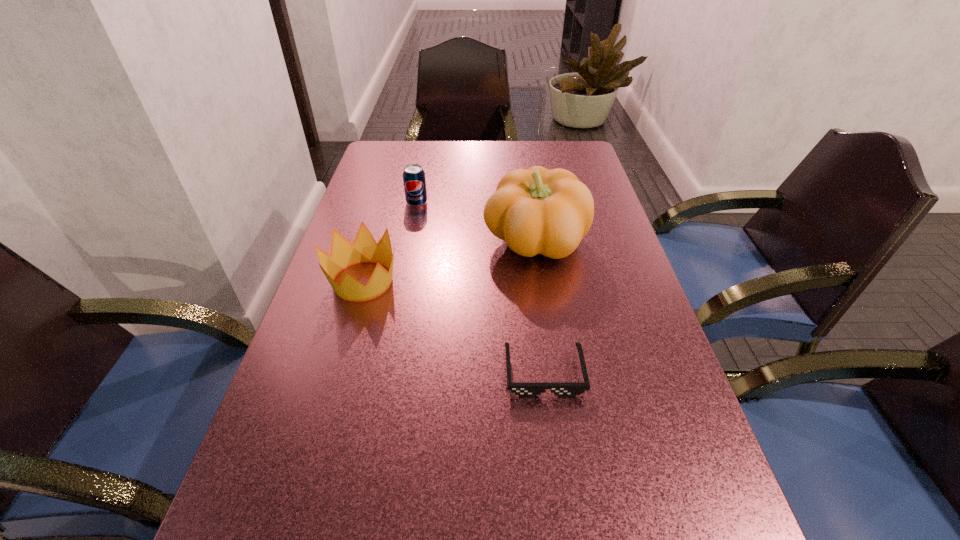
You are a GUI agent. You are given a task and a screenshot of the screen. Output one action in this format:
    pyautogui.click(x=<x>, y=<y>)
    Task: Click on the tallest object
    This screenshot has width=960, height=540.
    Given the screenshot: What is the action you would take?
    pyautogui.click(x=536, y=211)

Where is `soda can`? The height and width of the screenshot is (540, 960). soda can is located at coordinates (414, 181).

The height and width of the screenshot is (540, 960). I want to click on crown, so click(364, 248).

You are a GUI agent. You are given a task and a screenshot of the screen. Output one action in this format:
    pyautogui.click(x=<x>, y=<y>)
    Task: Click on the shortest object
    
    Given the screenshot: What is the action you would take?
    point(521,389)

Identify the location of sunglasses. This screenshot has width=960, height=540. (521, 389).

Where is `vacant space situated 0.390m on the front of the tallest object`? vacant space situated 0.390m on the front of the tallest object is located at coordinates (563, 423).

This screenshot has width=960, height=540. In order to click on vacant space positioned on the front of the farthest object in this screenshot , I will do coord(408,247).

Image resolution: width=960 pixels, height=540 pixels. What are the coordinates of `vacant space located on the back of the crown` in the screenshot? It's located at (389, 192).

Where is `blank area located 0.220m on the front-facing side of the sunglasses`? Image resolution: width=960 pixels, height=540 pixels. blank area located 0.220m on the front-facing side of the sunglasses is located at coordinates (564, 528).

I want to click on soda can located at the left edge, so click(x=414, y=181).